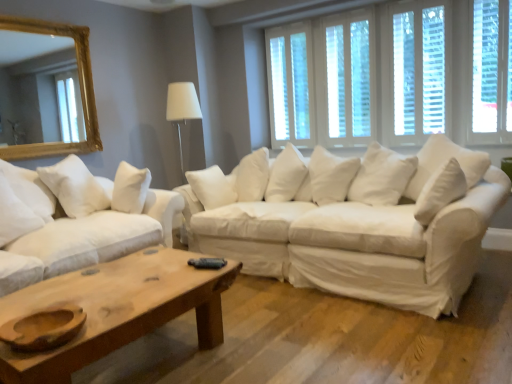
Question: In which direction should I rotate to look at white fabric couch at center, marked as the 2th studio couch in a left-to-right arrangement?

Choices:
 (A) left
 (B) right

Answer: (B)

Question: Is white wood window at upper center, positioned as the 2th window in left-to-right order, surrounded by white fabric couch at center, marked as the 2th studio couch in a left-to-right arrangement?

Choices:
 (A) no
 (B) yes

Answer: (A)

Question: Is white fabric couch at center, arranged as the first studio couch when viewed from the right, not within white wood window at upper center, positioned as the 3th window in right-to-left order?

Choices:
 (A) yes
 (B) no

Answer: (A)

Question: From a real-world perspective, does white fabric couch at center, marked as the 2th studio couch in a left-to-right arrangement, stand above white wood window at upper center, positioned as the 2th window in left-to-right order?

Choices:
 (A) yes
 (B) no

Answer: (B)

Question: Does white fabric couch at center, arranged as the first studio couch when viewed from the right, appear on the right side of white wood window at upper center, positioned as the 2th window in left-to-right order?

Choices:
 (A) no
 (B) yes

Answer: (A)

Question: Is white fabric couch at center, arranged as the first studio couch when viewed from the right, far away from white wood window at upper center, positioned as the 3th window in right-to-left order?

Choices:
 (A) no
 (B) yes

Answer: (B)

Question: Is white fabric couch at center, arranged as the first studio couch when viewed from the right, in front of white wood window at upper center, positioned as the 3th window in right-to-left order?

Choices:
 (A) no
 (B) yes

Answer: (B)

Question: From the image's perspective, is white wood window at upper right, positioned as the fourth window in left-to-right order, under gold-framed mirror at upper left?

Choices:
 (A) no
 (B) yes

Answer: (A)

Question: Is white wood window at upper right, positioned as the fourth window in left-to-right order, at the right side of gold-framed mirror at upper left?

Choices:
 (A) yes
 (B) no

Answer: (A)

Question: Is white wood window at upper right, positioned as the fourth window in left-to-right order, smaller than gold-framed mirror at upper left?

Choices:
 (A) yes
 (B) no

Answer: (A)

Question: Could you tell me if white wood window at upper right, the first window in the right-to-left sequence, is facing gold-framed mirror at upper left?

Choices:
 (A) yes
 (B) no

Answer: (B)

Question: Does white wood window at upper right, the first window in the right-to-left sequence, touch gold-framed mirror at upper left?

Choices:
 (A) yes
 (B) no

Answer: (B)

Question: Can you confirm if white wood window at upper right, positioned as the fourth window in left-to-right order, is taller than gold-framed mirror at upper left?

Choices:
 (A) no
 (B) yes

Answer: (B)

Question: Is white wood window at upper center, which is the first window from left to right, wider than white soft pillow at left?

Choices:
 (A) no
 (B) yes

Answer: (A)